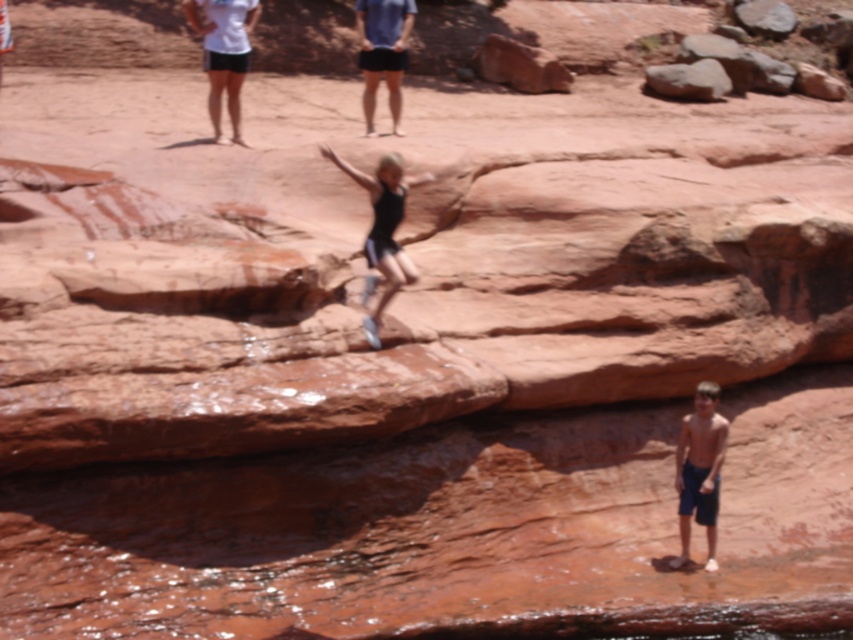
Is shiny blue shorts at lower right taller than smooth rock at upper center?

Indeed, shiny blue shorts at lower right has a greater height compared to smooth rock at upper center.

Can you confirm if shiny blue shorts at lower right is wider than smooth rock at upper center?

Incorrect, shiny blue shorts at lower right's width does not surpass smooth rock at upper center's.

Does point (685, 490) come farther from viewer compared to point (770, 20)?

No, it is not.

At what (x,y) coordinates should I click in order to perform the action: click on shiny blue shorts at lower right. Please return your answer as a coordinate pair (x, y). Image resolution: width=853 pixels, height=640 pixels. Looking at the image, I should click on (699, 468).

Find the location of a particular element. smooth reddish rock at upper center is located at coordinates (520, 65).

Does smooth reddish rock at upper center have a lesser width compared to smooth rock at upper center?

No.

Between point (515, 77) and point (764, 1), which one is positioned behind?

Positioned behind is point (764, 1).

Locate an element on the screen. Image resolution: width=853 pixels, height=640 pixels. smooth reddish rock at upper center is located at coordinates (520, 65).

Based on the photo, measure the distance between point [398,196] and camera.

The distance of point [398,196] from camera is 8.95 meters.

Image resolution: width=853 pixels, height=640 pixels. What are the coordinates of `black matte shorts at center` in the screenshot? It's located at (383, 227).